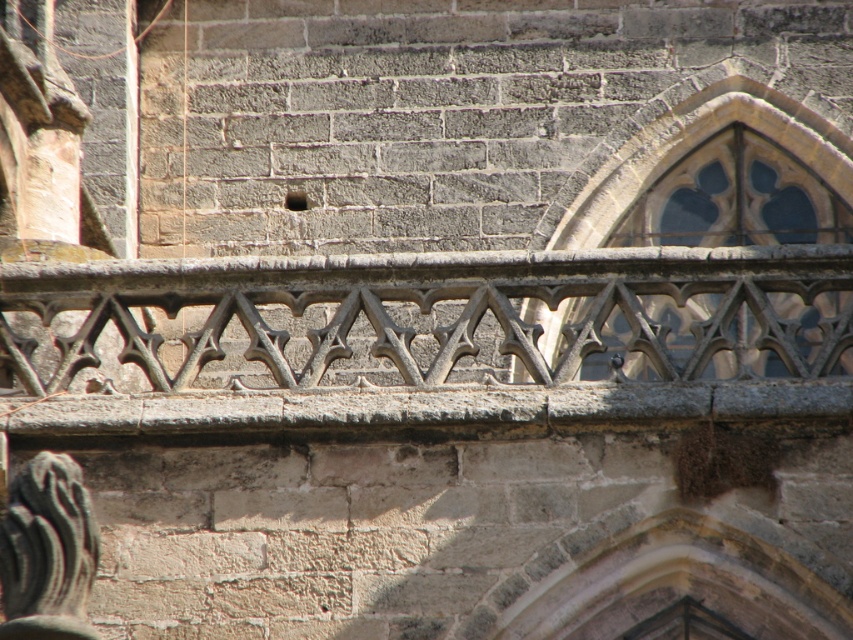
Is gray stone railing at center thinner than stone stained glass window at upper right?

No.

Locate an element on the screen. This screenshot has height=640, width=853. gray stone railing at center is located at coordinates (438, 314).

Where is `gray stone railing at center`? Image resolution: width=853 pixels, height=640 pixels. gray stone railing at center is located at coordinates (438, 314).

At what (x,y) coordinates should I click in order to perform the action: click on gray stone railing at center. Please return your answer as a coordinate pair (x, y). Looking at the image, I should click on (438, 314).